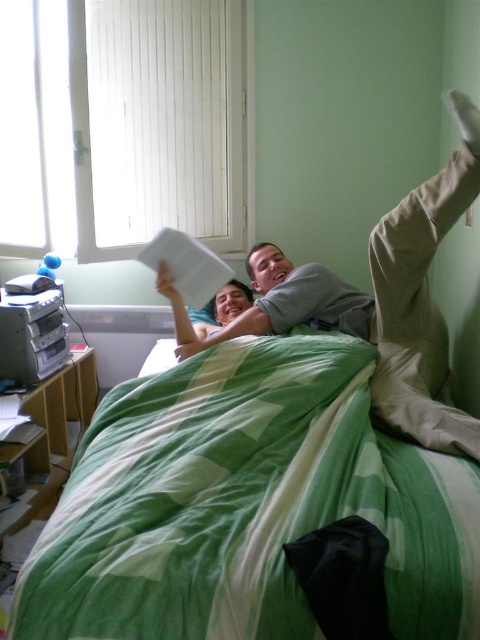
From the picture: Is green printed fabric blanket at center positioned behind gray cotton shirt at center?

That is False.

Which is behind, point (351, 346) or point (397, 337)?

The point (397, 337) is behind.

Identify the location of green printed fabric blanket at center. Image resolution: width=480 pixels, height=640 pixels. (245, 502).

This screenshot has height=640, width=480. I want to click on green printed fabric blanket at center, so click(x=245, y=502).